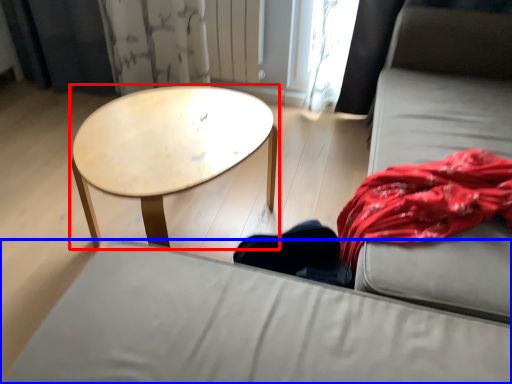
Question: Which object is further to the camera taking this photo, coffee table (highlighted by a red box) or studio couch (highlighted by a blue box)?

Choices:
 (A) coffee table
 (B) studio couch

Answer: (A)